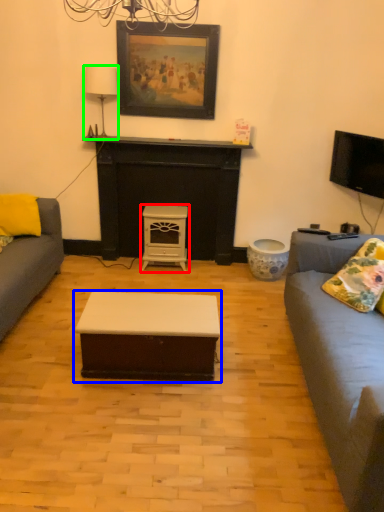
Question: Based on their relative distances, which object is nearer to stool (highlighted by a red box)? Choose from coffee table (highlighted by a blue box) and lamp (highlighted by a green box).

Choices:
 (A) coffee table
 (B) lamp

Answer: (B)